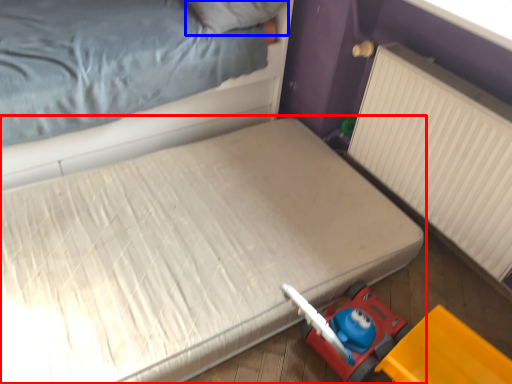
Question: Which object is further to the camera taking this photo, bed (highlighted by a red box) or pillow (highlighted by a blue box)?

Choices:
 (A) bed
 (B) pillow

Answer: (B)